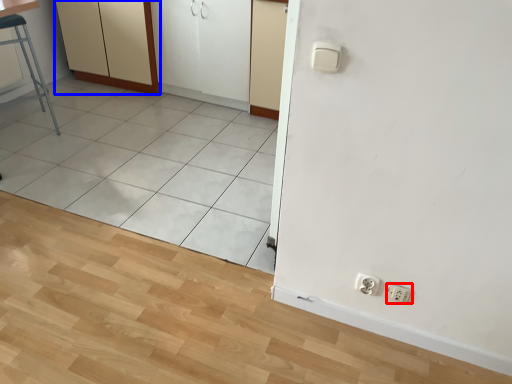
Question: Which of the following is the farthest to the observer, socket (highlighted by a red box) or dresser (highlighted by a blue box)?

Choices:
 (A) socket
 (B) dresser

Answer: (B)